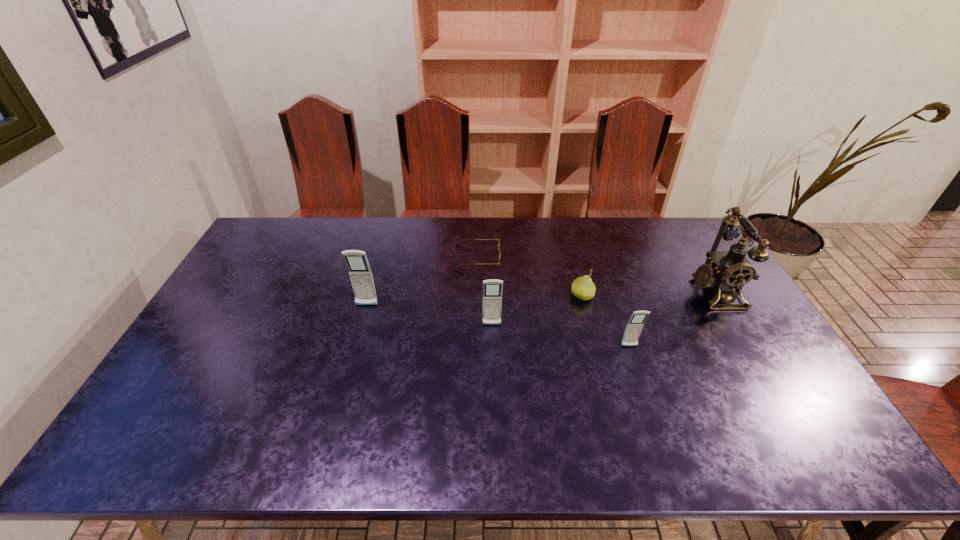
The width and height of the screenshot is (960, 540). In order to click on the tallest cellular telephone in this screenshot , I will do `click(360, 273)`.

You are a GUI agent. You are given a task and a screenshot of the screen. Output one action in this format:
    pyautogui.click(x=<x>, y=<y>)
    Task: Click on the second tallest object
    The image size is (960, 540).
    Given the screenshot: What is the action you would take?
    pyautogui.click(x=360, y=273)

Identify the location of the second nearest object. (492, 289).

Where is `the second tallest cellular telephone`? the second tallest cellular telephone is located at coordinates (492, 289).

The image size is (960, 540). What are the coordinates of `the shortest cellular telephone` in the screenshot? It's located at (635, 324).

Locate an element on the screen. This screenshot has width=960, height=540. the fifth object from left to right is located at coordinates (635, 324).

The width and height of the screenshot is (960, 540). Identify the location of the shortest object. (499, 253).

The image size is (960, 540). I want to click on the second shortest object, so click(x=583, y=288).

Identify the location of the third object from right to left. (583, 288).

This screenshot has height=540, width=960. Identify the location of the rightmost object. (729, 270).